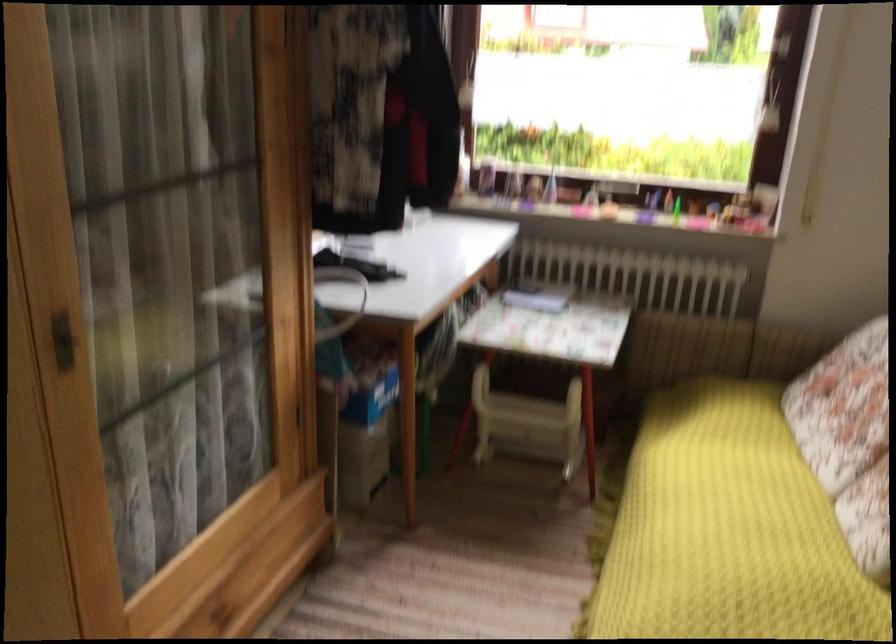
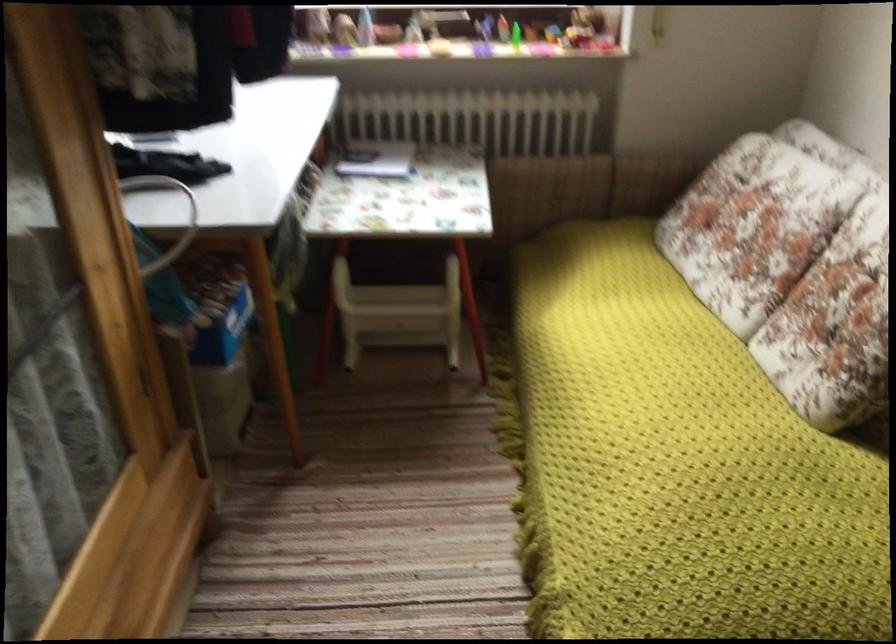
In a continuous first-person perspective shot, in which direction is the camera moving?

The cameraman moved toward left, forward.